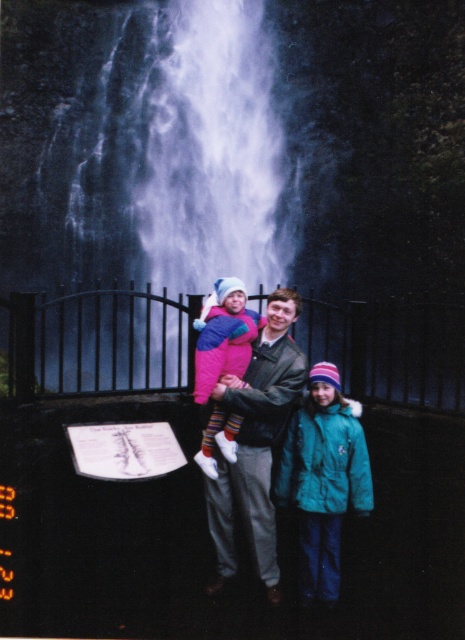
Does leather jacket at center have a lesser height compared to matte pink jacket at center?

In fact, leather jacket at center may be taller than matte pink jacket at center.

Between point (285, 403) and point (247, 355), which one is positioned behind?

The point (247, 355) is behind.

Locate an element on the screen. The image size is (465, 640). leather jacket at center is located at coordinates tap(256, 442).

The width and height of the screenshot is (465, 640). I want to click on leather jacket at center, so click(256, 442).

Does black metal fence at center have a greater width compared to teal fleece jacket at lower right?

Correct, the width of black metal fence at center exceeds that of teal fleece jacket at lower right.

Identify the location of black metal fence at center. Image resolution: width=465 pixels, height=640 pixels. (98, 342).

Who is more distant from viewer, (46, 369) or (333, 550)?

Point (46, 369)

This screenshot has height=640, width=465. Find the location of `black metal fence at center`. black metal fence at center is located at coordinates (98, 342).

Which of these two, black metal fence at center or matte pink jacket at center, stands taller?

Standing taller between the two is black metal fence at center.

Can you confirm if black metal fence at center is positioned to the right of matte pink jacket at center?

In fact, black metal fence at center is to the left of matte pink jacket at center.

The height and width of the screenshot is (640, 465). I want to click on black metal fence at center, so click(x=98, y=342).